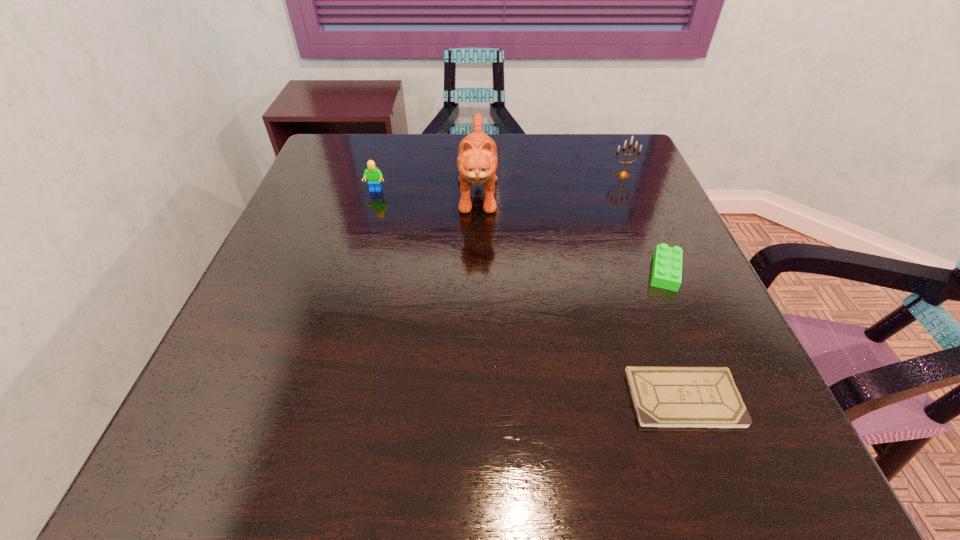
Image resolution: width=960 pixels, height=540 pixels. Identify the location of vacant space that satisfies the following two spatial constraints: 1. on the back side of the checkbook; 2. on the left side of the nearer Lego. (638, 272).

Locate an element on the screen. The width and height of the screenshot is (960, 540). free location that satisfies the following two spatial constraints: 1. on the face of the nearer Lego; 2. on the right side of the cat is located at coordinates (477, 272).